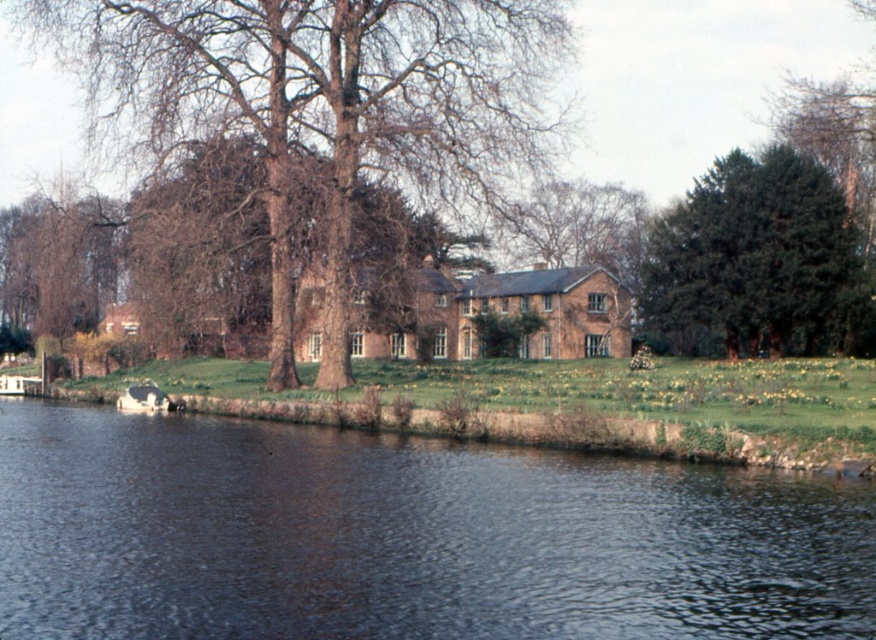
You are an artist planning to paint the riverside scene. You want to highlight the contrast between the brown textured tree at center and the bare branches at center. Which tree should you make larger in your painting?

The brown textured tree at center is bigger than the bare branches at center, so you should paint the brown textured tree at center larger to emphasize the contrast between them.